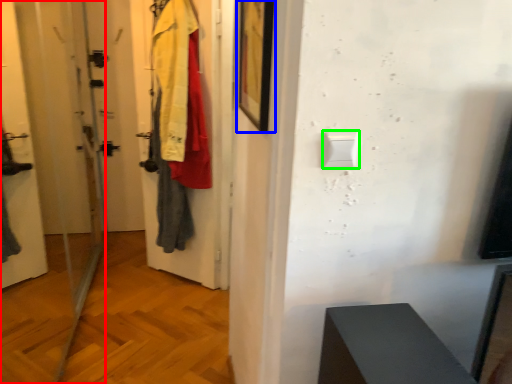
Question: Considering the real-world distances, which object is closest to screen door (highlighted by a red box)? picture frame (highlighted by a blue box) or light switch (highlighted by a green box).

Choices:
 (A) picture frame
 (B) light switch

Answer: (A)